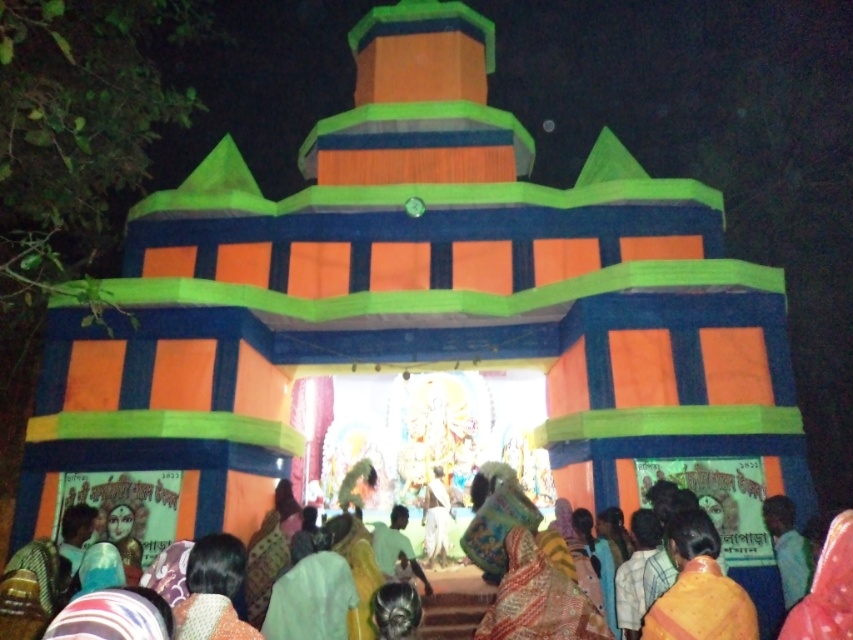
What do you see at coordinates (538, 598) in the screenshot?
I see `multicolored fabric robe at lower center` at bounding box center [538, 598].

Measure the distance from multicolored fabric robe at lower center to yellow fabric robe at center.

They are 12.76 meters apart.

Is point (505, 618) closer to viewer compared to point (752, 611)?

No, it is not.

Find the location of a particular element. Image resolution: width=853 pixels, height=640 pixels. multicolored fabric robe at lower center is located at coordinates (x=538, y=598).

Who is positioned more to the left, multicolored fabric at center or yellow fabric robe at center?

multicolored fabric at center

Which is in front, point (553, 579) or point (735, 593)?

Point (735, 593) is in front.

You are a GUI agent. You are given a task and a screenshot of the screen. Output one action in this format:
    pyautogui.click(x=<x>, y=<y>)
    Task: Click on the multicolored fabric at center
    This screenshot has height=640, width=853.
    Given the screenshot: What is the action you would take?
    pyautogui.click(x=521, y=572)

Can you confirm if multicolored fabric at center is wider than multicolored fabric robe at lower center?

Correct, the width of multicolored fabric at center exceeds that of multicolored fabric robe at lower center.

Which is more to the left, multicolored fabric at center or multicolored fabric robe at lower center?

From the viewer's perspective, multicolored fabric at center appears more on the left side.

Where is `multicolored fabric at center`? This screenshot has width=853, height=640. multicolored fabric at center is located at coordinates (521, 572).